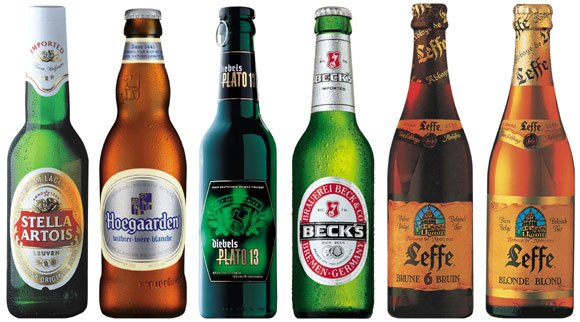
Where is `beer bottles`? beer bottles is located at coordinates (37, 196), (148, 195), (242, 200), (337, 198), (425, 206), (517, 217).